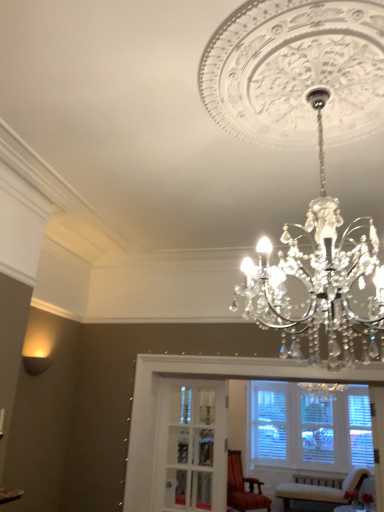
Identify the location of velvet beige chair at lower right, the 2th chair when ordered from left to right. (321, 490).

Image resolution: width=384 pixels, height=512 pixels. What do you see at coordinates (191, 446) in the screenshot?
I see `clear glass door at center` at bounding box center [191, 446].

The height and width of the screenshot is (512, 384). Describe the element at coordinates (243, 487) in the screenshot. I see `wooden armchair at center, placed as the first chair when sorted from left to right` at that location.

The width and height of the screenshot is (384, 512). Identify the location of matte black wall sconce at lower left. pyautogui.click(x=36, y=364).

Is clear glass door at center facing away from wooden armchair at center, arranged as the 2th chair when viewed from the right?

Yes.

Between point (196, 419) and point (258, 490), which one is positioned in front?

Positioned in front is point (258, 490).

From the image's perspective, is clear glass door at center located beneath wooden armchair at center, arranged as the 2th chair when viewed from the right?

Incorrect, from the image's perspective, clear glass door at center is higher than wooden armchair at center, arranged as the 2th chair when viewed from the right.

Can you confirm if clear glass door at center is smaller than wooden armchair at center, arranged as the 2th chair when viewed from the right?

Indeed, clear glass door at center has a smaller size compared to wooden armchair at center, arranged as the 2th chair when viewed from the right.

Can you confirm if velvet beige chair at lower right, the 1th chair from the right, is thinner than wooden armchair at center, placed as the first chair when sorted from left to right?

Correct, the width of velvet beige chair at lower right, the 1th chair from the right, is less than that of wooden armchair at center, placed as the first chair when sorted from left to right.

Is point (306, 492) closer or farther from the camera than point (252, 503)?

Point (306, 492).

In the scene shown: Is velvet beige chair at lower right, the 2th chair when ordered from left to right, positioned behind wooden armchair at center, placed as the first chair when sorted from left to right?

Yes, it is behind wooden armchair at center, placed as the first chair when sorted from left to right.

Is velvet beige chair at lower right, the 1th chair from the right, inside or outside of wooden armchair at center, placed as the first chair when sorted from left to right?

velvet beige chair at lower right, the 1th chair from the right, lies outside wooden armchair at center, placed as the first chair when sorted from left to right.

Considering the positions of objects velvet beige chair at lower right, the 2th chair when ordered from left to right, and matte black wall sconce at lower left in the image provided, who is more to the right, velvet beige chair at lower right, the 2th chair when ordered from left to right, or matte black wall sconce at lower left?

velvet beige chair at lower right, the 2th chair when ordered from left to right, is more to the right.

Looking at this image, would you consider velvet beige chair at lower right, the 2th chair when ordered from left to right, to be distant from matte black wall sconce at lower left?

velvet beige chair at lower right, the 2th chair when ordered from left to right, is positioned a significant distance from matte black wall sconce at lower left.

In order to click on the 2nd chair behind the matte black wall sconce at lower left in this screenshot , I will do `click(321, 490)`.

Between velvet beige chair at lower right, the 2th chair when ordered from left to right, and matte black wall sconce at lower left, which one has smaller width?

With smaller width is matte black wall sconce at lower left.

Who is taller, wooden armchair at center, placed as the first chair when sorted from left to right, or matte black wall sconce at lower left?

wooden armchair at center, placed as the first chair when sorted from left to right.

Considering the relative sizes of wooden armchair at center, arranged as the 2th chair when viewed from the right, and matte black wall sconce at lower left in the image provided, is wooden armchair at center, arranged as the 2th chair when viewed from the right, wider than matte black wall sconce at lower left?

Correct, the width of wooden armchair at center, arranged as the 2th chair when viewed from the right, exceeds that of matte black wall sconce at lower left.

Is point (245, 496) positioned before point (42, 370)?

No.

From the image's perspective, which is below, wooden armchair at center, placed as the first chair when sorted from left to right, or matte black wall sconce at lower left?

wooden armchair at center, placed as the first chair when sorted from left to right, is shown below in the image.

From a real-world perspective, which object rests below the other?

In real-world perspective, clear glass door at center is lower.

Which of these two, clear glass door at center or matte black wall sconce at lower left, is wider?

With larger width is matte black wall sconce at lower left.

Is clear glass door at center oriented away from matte black wall sconce at lower left?

No, clear glass door at center is not facing the opposite direction of matte black wall sconce at lower left.

Based on the photo, which object is positioned more to the left, wooden armchair at center, placed as the first chair when sorted from left to right, or velvet beige chair at lower right, the 2th chair when ordered from left to right?

wooden armchair at center, placed as the first chair when sorted from left to right.

Could you tell me if wooden armchair at center, arranged as the 2th chair when viewed from the right, is facing velvet beige chair at lower right, the 2th chair when ordered from left to right?

No, wooden armchair at center, arranged as the 2th chair when viewed from the right, is not oriented towards velvet beige chair at lower right, the 2th chair when ordered from left to right.

Who is smaller, wooden armchair at center, arranged as the 2th chair when viewed from the right, or velvet beige chair at lower right, the 1th chair from the right?

wooden armchair at center, arranged as the 2th chair when viewed from the right, is smaller.

From a real-world perspective, is wooden armchair at center, placed as the first chair when sorted from left to right, located higher than velvet beige chair at lower right, the 1th chair from the right?

Correct, in the physical world, wooden armchair at center, placed as the first chair when sorted from left to right, is higher than velvet beige chair at lower right, the 1th chair from the right.

Which is closer, (197, 387) or (296, 497)?

The point (296, 497) is in front.

Considering the sizes of clear glass door at center and velvet beige chair at lower right, the 2th chair when ordered from left to right, in the image, is clear glass door at center taller or shorter than velvet beige chair at lower right, the 2th chair when ordered from left to right,?

Clearly, clear glass door at center is taller compared to velvet beige chair at lower right, the 2th chair when ordered from left to right.

Which object is more forward, clear glass door at center or velvet beige chair at lower right, the 2th chair when ordered from left to right?

clear glass door at center.

What are the coordinates of `glass door above the wooden armchair at center, arranged as the 2th chair when viewed from the right (from a real-world perspective)` in the screenshot? It's located at (191, 446).

Find the location of a particular element. The height and width of the screenshot is (512, 384). chair above the velvet beige chair at lower right, the 1th chair from the right (from the image's perspective) is located at coordinates (243, 487).

When comparing their distances from wooden armchair at center, arranged as the 2th chair when viewed from the right, does velvet beige chair at lower right, the 1th chair from the right, or matte black wall sconce at lower left seem further?

matte black wall sconce at lower left.

Looking at the image, which one is located further to velvet beige chair at lower right, the 1th chair from the right, clear glass door at center or matte black wall sconce at lower left?

matte black wall sconce at lower left is further to velvet beige chair at lower right, the 1th chair from the right.

Looking at the image, which one is located closer to velvet beige chair at lower right, the 1th chair from the right, matte black wall sconce at lower left or wooden armchair at center, placed as the first chair when sorted from left to right?

The object closer to velvet beige chair at lower right, the 1th chair from the right, is wooden armchair at center, placed as the first chair when sorted from left to right.

Considering their positions, is clear glass door at center positioned closer to velvet beige chair at lower right, the 1th chair from the right, than wooden armchair at center, arranged as the 2th chair when viewed from the right?

wooden armchair at center, arranged as the 2th chair when viewed from the right, is closer to velvet beige chair at lower right, the 1th chair from the right.

Considering their positions, is matte black wall sconce at lower left positioned closer to wooden armchair at center, placed as the first chair when sorted from left to right, than velvet beige chair at lower right, the 2th chair when ordered from left to right?

velvet beige chair at lower right, the 2th chair when ordered from left to right, lies closer to wooden armchair at center, placed as the first chair when sorted from left to right, than the other object.

Considering their positions, is clear glass door at center positioned closer to wooden armchair at center, placed as the first chair when sorted from left to right, than velvet beige chair at lower right, the 2th chair when ordered from left to right?

velvet beige chair at lower right, the 2th chair when ordered from left to right, is positioned closer to the anchor wooden armchair at center, placed as the first chair when sorted from left to right.

From the image, which object appears to be nearer to clear glass door at center, matte black wall sconce at lower left or velvet beige chair at lower right, the 1th chair from the right?

The object closer to clear glass door at center is velvet beige chair at lower right, the 1th chair from the right.

When comparing their distances from velvet beige chair at lower right, the 1th chair from the right, does wooden armchair at center, placed as the first chair when sorted from left to right, or matte black wall sconce at lower left seem further?

matte black wall sconce at lower left is positioned further to the anchor velvet beige chair at lower right, the 1th chair from the right.

The image size is (384, 512). In order to click on glass door between matte black wall sconce at lower left and wooden armchair at center, placed as the first chair when sorted from left to right, in the front-back direction in this screenshot , I will do `click(191, 446)`.

Image resolution: width=384 pixels, height=512 pixels. I want to click on chair between clear glass door at center and velvet beige chair at lower right, the 2th chair when ordered from left to right, along the z-axis, so click(243, 487).

Locate an element on the screen. The width and height of the screenshot is (384, 512). chair between matte black wall sconce at lower left and velvet beige chair at lower right, the 2th chair when ordered from left to right, from front to back is located at coordinates (243, 487).

What are the coordinates of `glass door between matte black wall sconce at lower left and velvet beige chair at lower right, the 1th chair from the right, from front to back` in the screenshot? It's located at (191, 446).